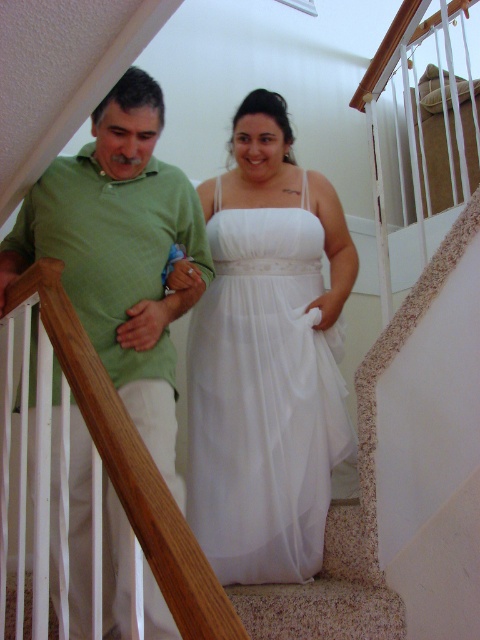
Question: Where is white chiffon dress at center located in relation to green matte shirt at left in the image?

Choices:
 (A) above
 (B) below

Answer: (A)

Question: Among these points, which one is nearest to the camera?

Choices:
 (A) (334, 310)
 (B) (169, 435)

Answer: (B)

Question: Does white chiffon dress at center lie in front of green matte shirt at left?

Choices:
 (A) no
 (B) yes

Answer: (A)

Question: Which point is farther to the camera?

Choices:
 (A) white chiffon dress at center
 (B) green matte shirt at left

Answer: (A)

Question: Which of the following is the closest to the observer?

Choices:
 (A) white chiffon dress at center
 (B) green matte shirt at left

Answer: (B)

Question: Is white chiffon dress at center positioned in front of green matte shirt at left?

Choices:
 (A) no
 (B) yes

Answer: (A)